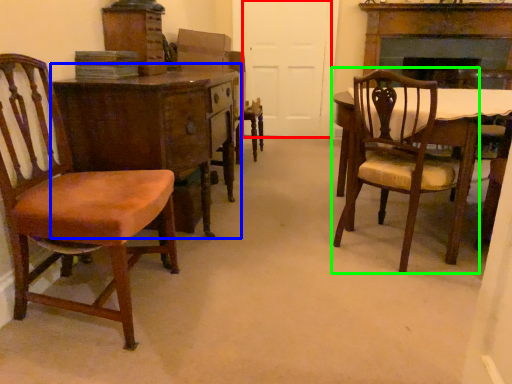
Question: Which object is positioned closest to door (highlighted by a red box)? Select from desk (highlighted by a blue box) and chair (highlighted by a green box).

Choices:
 (A) desk
 (B) chair

Answer: (B)